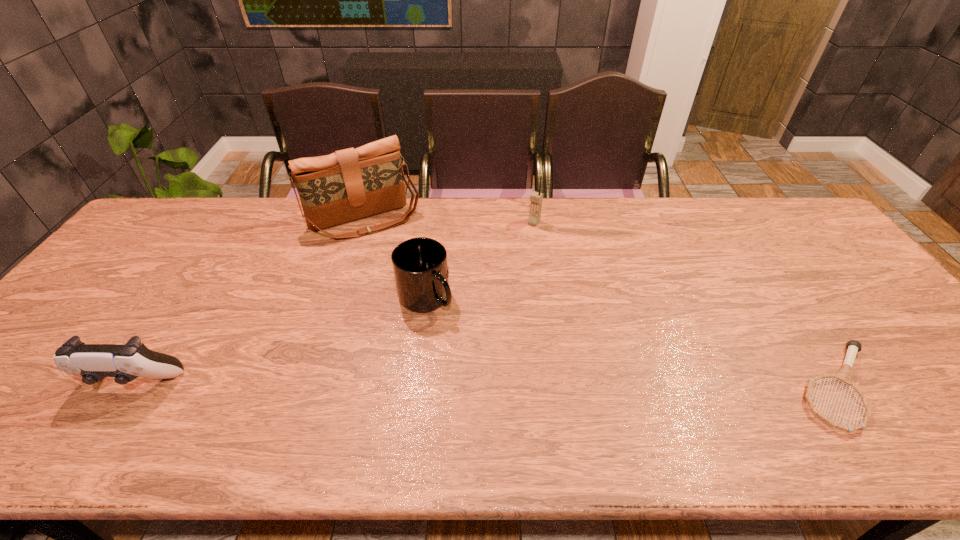
Where is `free space on the desktop that is between the control and the rightmost object and is positioned with the handle on the side of the third farthest object`? The width and height of the screenshot is (960, 540). free space on the desktop that is between the control and the rightmost object and is positioned with the handle on the side of the third farthest object is located at coordinates (483, 384).

At what (x,y) coordinates should I click in order to perform the action: click on free space on the desktop that is between the control and the tennis racket and is positioned on the front of the fourth object from left to right, where the keypad is located. Please return your answer as a coordinate pair (x, y). The height and width of the screenshot is (540, 960). Looking at the image, I should click on (425, 384).

The image size is (960, 540). What are the coordinates of `free space on the desktop that is between the leftmost object and the shortest object and is positioned on the front-facing side of the tallest object` in the screenshot? It's located at (450, 384).